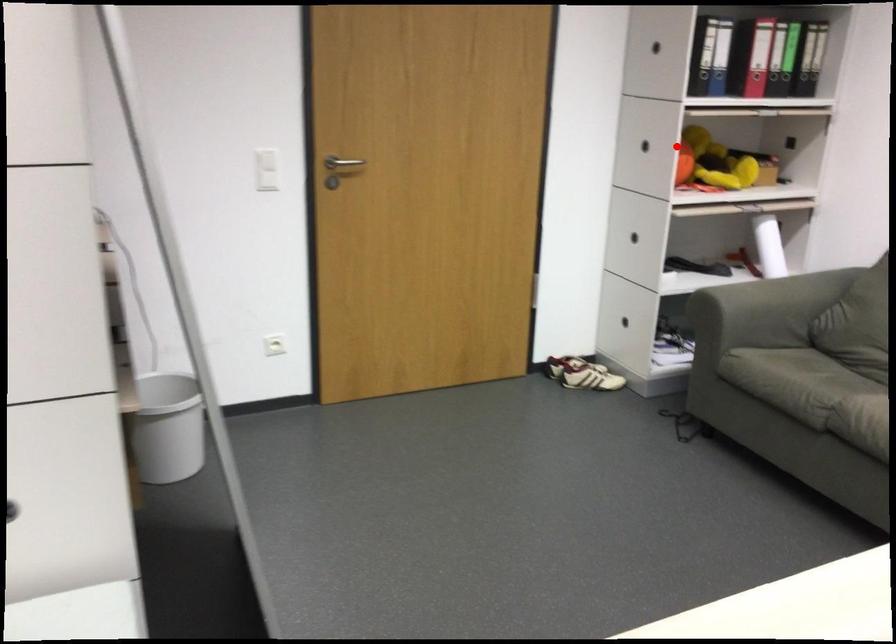
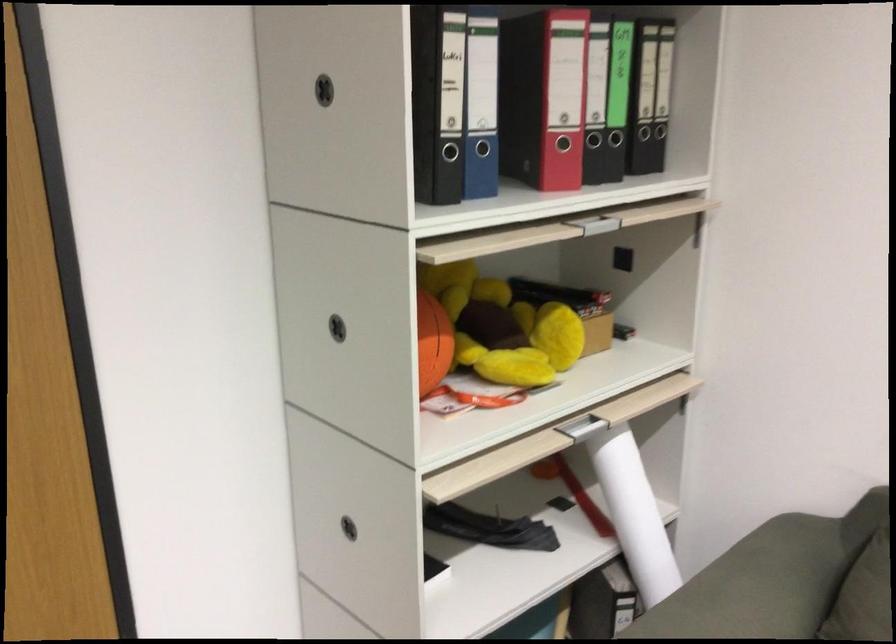
Where in the second image is the point corresponding to the highlighted location from the first image?

(433, 343)